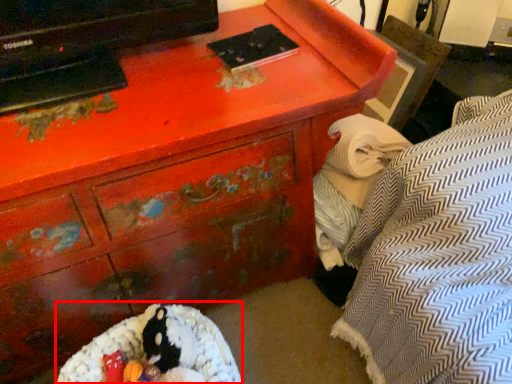
Question: From the image's perspective, considering the relative positions of bean bag chair (annotated by the red box) and blanket in the image provided, where is bean bag chair (annotated by the red box) located with respect to the staircase?

Choices:
 (A) above
 (B) below

Answer: (B)